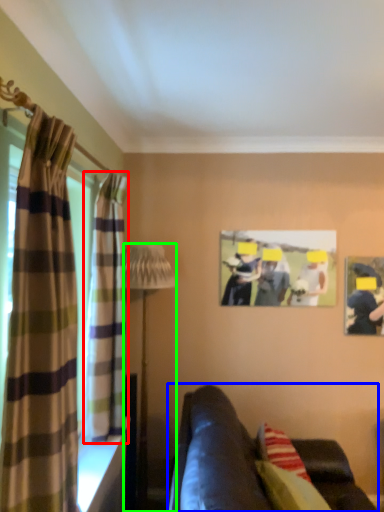
Question: Which is nearer to the curtain (highlighted by a red box)? studio couch (highlighted by a blue box) or lamp (highlighted by a green box).

Choices:
 (A) studio couch
 (B) lamp

Answer: (A)